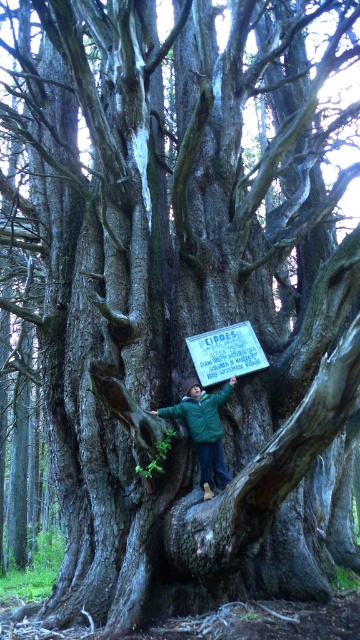
Between green matte jacket at center and wooden sign at center, which one is positioned lower?

green matte jacket at center is below.

Between green matte jacket at center and wooden sign at center, which one is positioned higher?

wooden sign at center is above.

Who is more forward, (235, 381) or (241, 349)?

Point (235, 381)

Where is `green matte jacket at center`? The width and height of the screenshot is (360, 640). green matte jacket at center is located at coordinates coord(204,429).